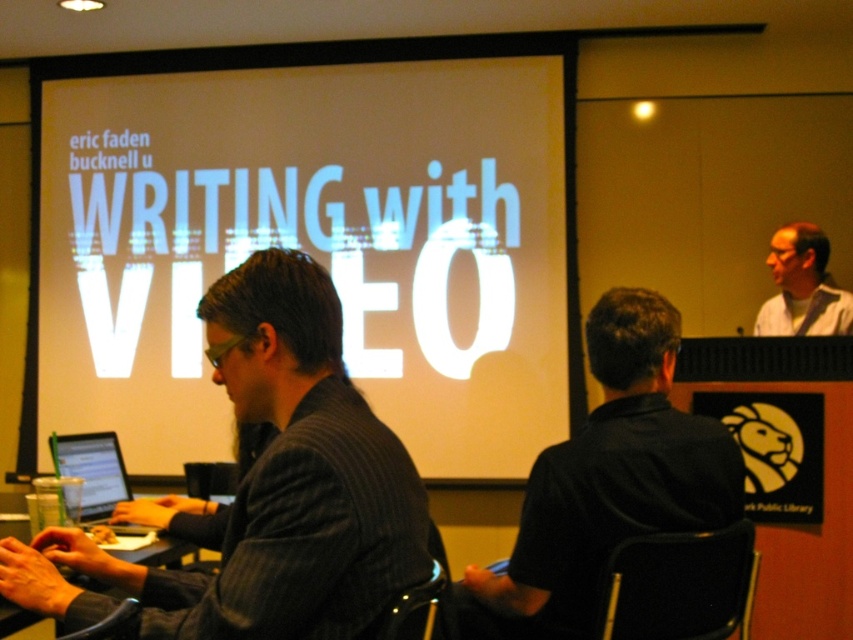
Question: Among these objects, which one is nearest to the camera?

Choices:
 (A) wooden table at lower left
 (B) black shirt at center
 (C) dark gray suit at center
 (D) gray fabric shirt at upper right

Answer: (C)

Question: Does dark gray suit at center appear over black shirt at center?

Choices:
 (A) yes
 (B) no

Answer: (A)

Question: Does white matte projection screen at center have a smaller size compared to matte black laptop at left?

Choices:
 (A) yes
 (B) no

Answer: (B)

Question: Which object is closer to the camera taking this photo?

Choices:
 (A) wooden table at lower left
 (B) white matte projection screen at center
 (C) matte black laptop at left

Answer: (A)

Question: Which point is farther to the camera?

Choices:
 (A) (636, 291)
 (B) (815, 276)
 (C) (103, 515)

Answer: (B)

Question: In this image, where is dark gray suit at center located relative to black shirt at center?

Choices:
 (A) above
 (B) below

Answer: (A)